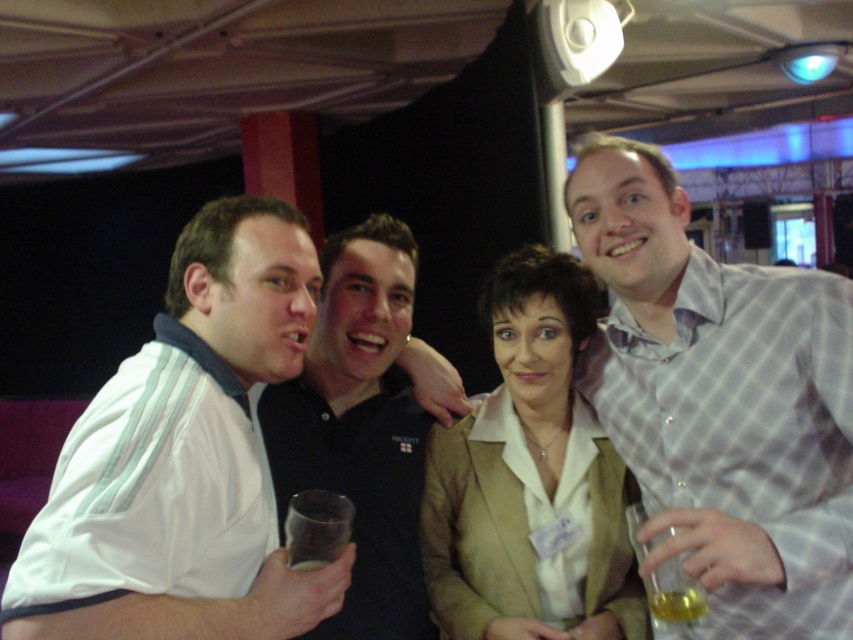
The width and height of the screenshot is (853, 640). What do you see at coordinates (184, 458) in the screenshot?
I see `white fabric shirt at left` at bounding box center [184, 458].

Does white fabric shirt at left lie behind black matte shirt at center?

No.

Who is more distant from viewer, (309,317) or (413,573)?

The point (413,573) is behind.

Locate an element on the screen. white fabric shirt at left is located at coordinates (184, 458).

Is point (680, 262) closer to viewer compared to point (387, 602)?

Yes, point (680, 262) is in front of point (387, 602).

This screenshot has width=853, height=640. What do you see at coordinates (721, 403) in the screenshot? I see `light gray checkered shirt at upper right` at bounding box center [721, 403].

Does point (691, 442) come in front of point (338, 236)?

Yes, it is in front of point (338, 236).

Locate an element on the screen. The width and height of the screenshot is (853, 640). light gray checkered shirt at upper right is located at coordinates (721, 403).

Can you confirm if white fabric shirt at left is positioned to the left of beige fabric jacket at center?

Correct, you'll find white fabric shirt at left to the left of beige fabric jacket at center.

Is point (274, 532) closer to camera compared to point (432, 600)?

Yes.

Does point (126, 609) come closer to viewer compared to point (523, 605)?

Yes, point (126, 609) is in front of point (523, 605).

This screenshot has height=640, width=853. I want to click on white fabric shirt at left, so click(x=184, y=458).